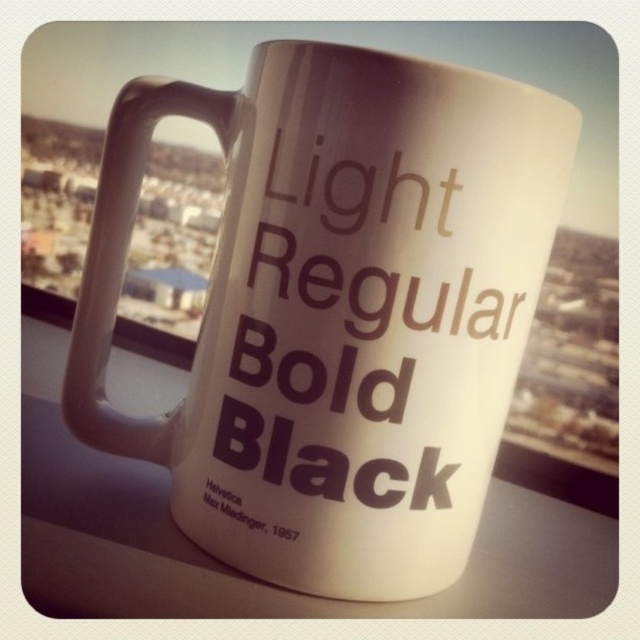
Does point (324, 442) lie in front of point (244, 512)?

Yes, it is in front of point (244, 512).

Which is in front, point (426, 481) or point (291, 529)?

Point (291, 529) is more forward.

Where is `bold matte text at center`? The height and width of the screenshot is (640, 640). bold matte text at center is located at coordinates (360, 342).

Between white matte mug at center and black matte text at lower left, which one has less height?

With less height is black matte text at lower left.

Which is above, white matte mug at center or black matte text at lower left?

Positioned higher is white matte mug at center.

Is point (237, 468) farther from camera compared to point (228, 516)?

No, (237, 468) is in front of (228, 516).

Where is `white matte mug at center`? white matte mug at center is located at coordinates (339, 308).

Does white matte mug at center have a larger size compared to bold matte text at center?

Yes, white matte mug at center is bigger than bold matte text at center.

Is the position of white matte mug at center less distant than that of bold matte text at center?

That is True.

I want to click on white matte mug at center, so click(339, 308).

Where is `white matte mug at center`? white matte mug at center is located at coordinates (339, 308).